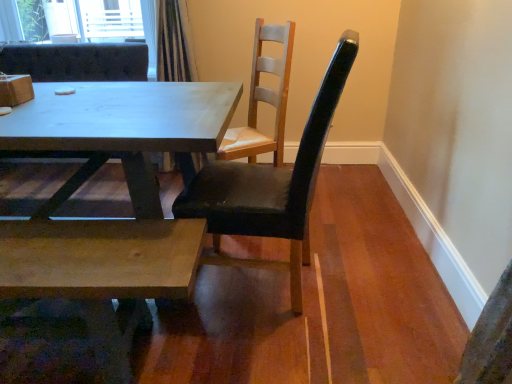
Where is `vacant space underneath black leather chair at center, the first chair viewed from the right (from a real-world perspective)`? This screenshot has width=512, height=384. vacant space underneath black leather chair at center, the first chair viewed from the right (from a real-world perspective) is located at coordinates (280, 291).